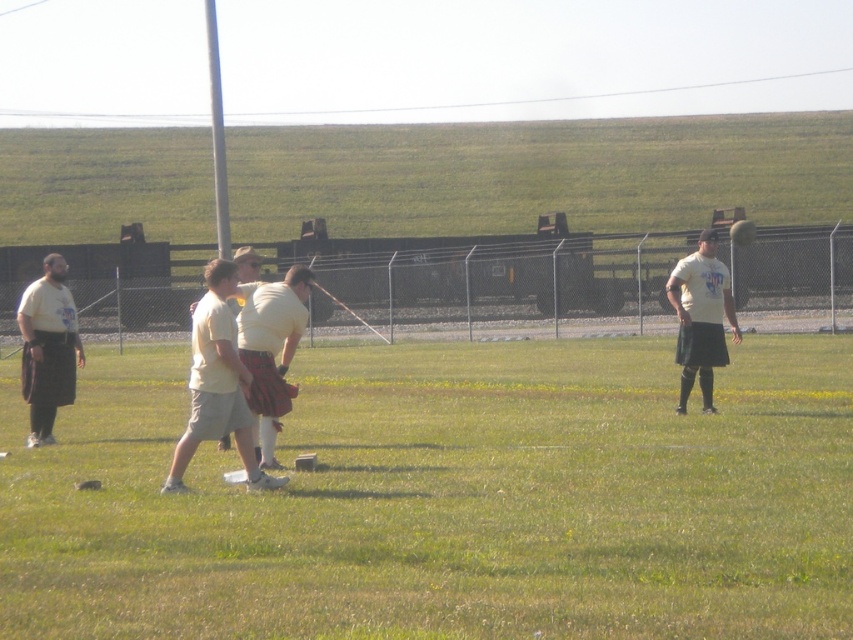
Question: Does green grass at center come in front of plaid fabric kilt at center?

Choices:
 (A) no
 (B) yes

Answer: (B)

Question: Can you confirm if plaid fabric kilt at center is positioned to the right of matte black kilt at left?

Choices:
 (A) no
 (B) yes

Answer: (B)

Question: Among these points, which one is farthest from the camera?

Choices:
 (A) (251, 268)
 (B) (67, 337)
 (C) (450, 612)

Answer: (B)

Question: Estimate the real-world distances between objects in this image. Which object is closer to the matte white t-shirt at right?

Choices:
 (A) green grass at center
 (B) light beige cotton t-shirt at center
 (C) light yellow shirt at center

Answer: (A)

Question: Is light beige cotton t-shirt at center above matte white t-shirt at right?

Choices:
 (A) yes
 (B) no

Answer: (B)

Question: Estimate the real-world distances between objects in this image. Which object is farther from the matte white t-shirt at right?

Choices:
 (A) green grass at center
 (B) matte black kilt at left
 (C) light yellow shirt at center

Answer: (C)